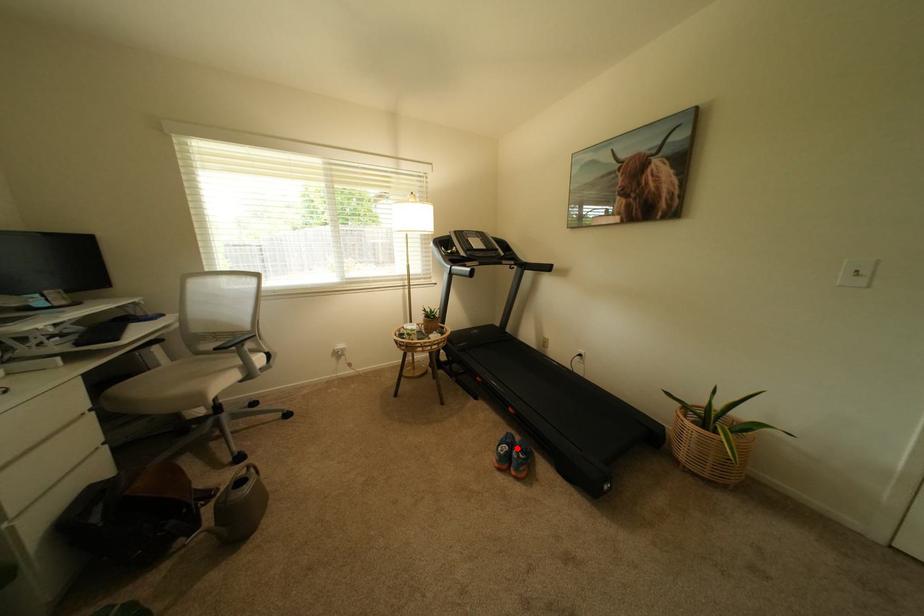
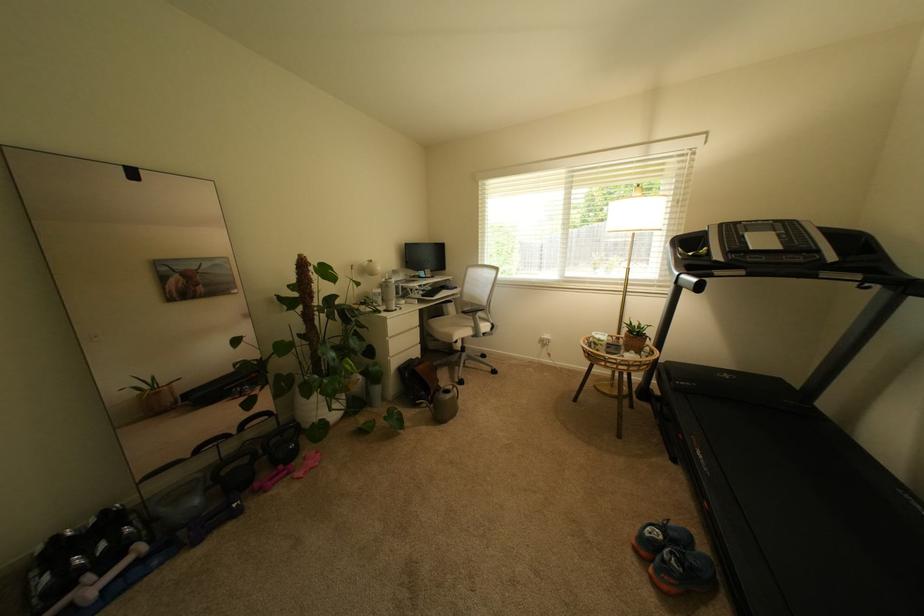
In the second image, find the point that corresponds to the highlighted location in the first image.

(673, 540)